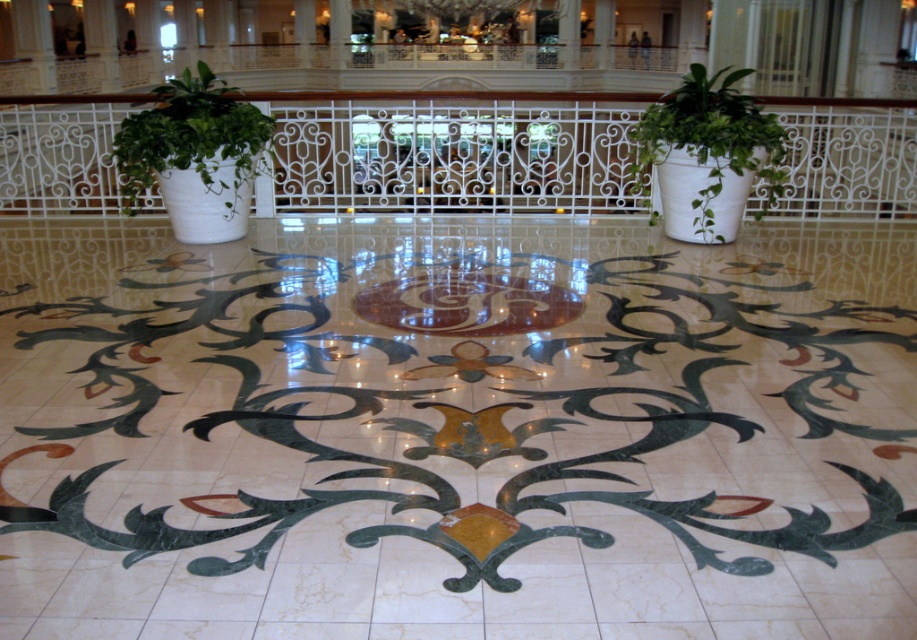
Which of these two, green matte plant at center or green leafy plant at left, stands taller?

With more height is green matte plant at center.

Does green matte plant at center have a larger size compared to green leafy plant at left?

Yes.

The height and width of the screenshot is (640, 917). I want to click on green matte plant at center, so click(x=706, y=154).

Locate an element on the screen. The width and height of the screenshot is (917, 640). green matte plant at center is located at coordinates (706, 154).

Image resolution: width=917 pixels, height=640 pixels. Describe the element at coordinates (455, 154) in the screenshot. I see `white wrought iron at center` at that location.

Is white wrought iron at center wider than green leafy plant at left?

Correct, the width of white wrought iron at center exceeds that of green leafy plant at left.

Does point (90, 150) lie in front of point (245, 116)?

That is False.

I want to click on white wrought iron at center, so (455, 154).

Can you confirm if white wrought iron at center is thinner than green matte plant at center?

Indeed, white wrought iron at center has a lesser width compared to green matte plant at center.

The image size is (917, 640). I want to click on white wrought iron at center, so click(x=455, y=154).

Locate an element on the screen. white wrought iron at center is located at coordinates (455, 154).